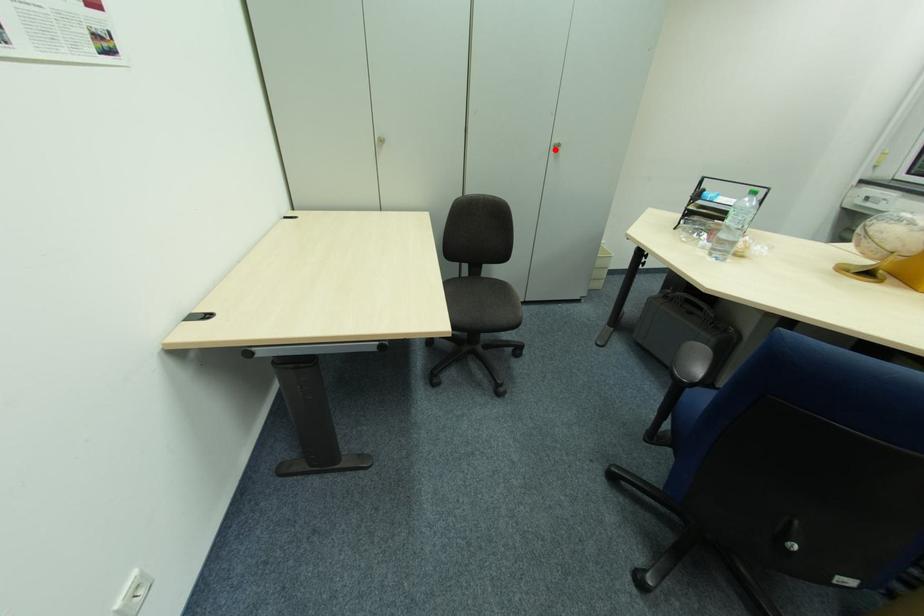
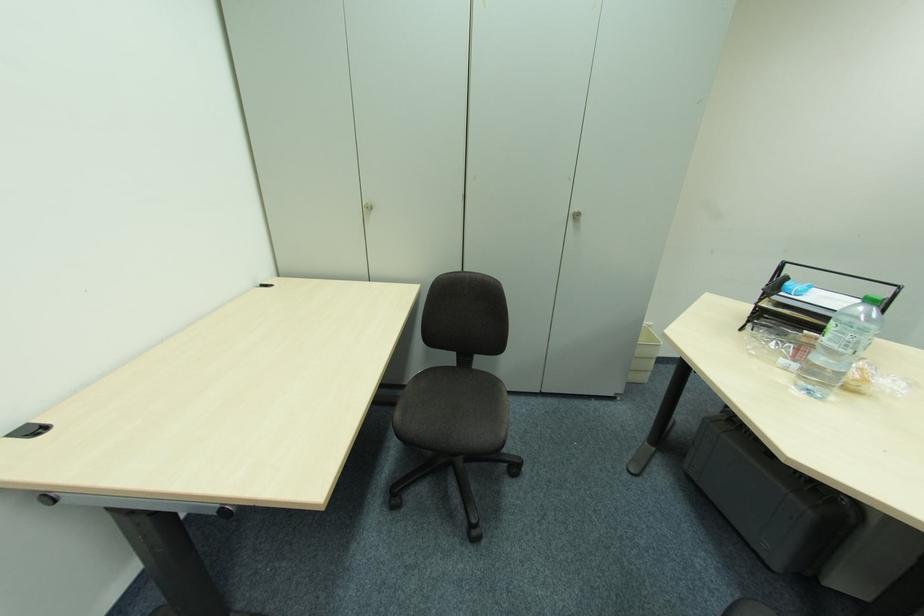
The point at the highlighted location is marked in the first image. Where is the corresponding point in the second image?

(574, 219)